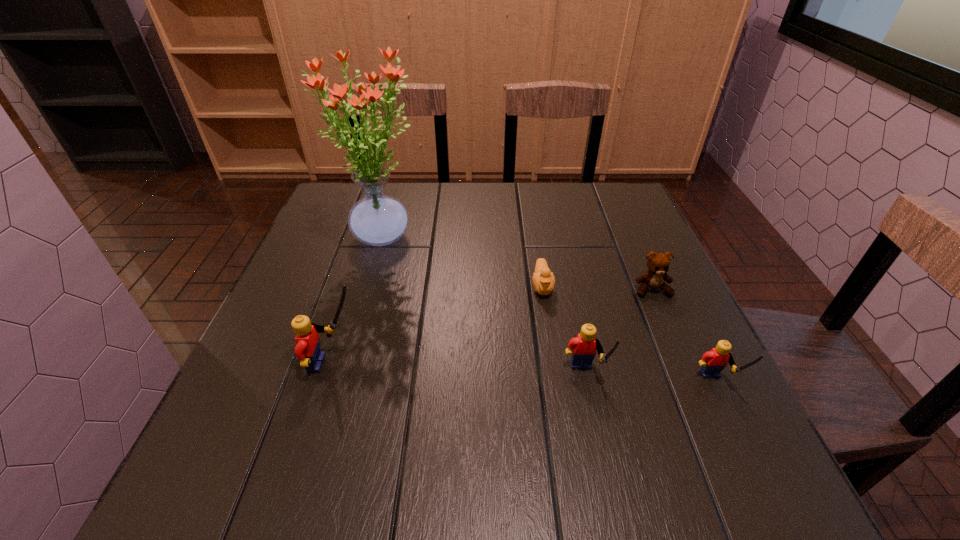
To make them evenly spaced by inserting another Lego among them, please locate a vacant spot for this new Lego. Please provide its 2D coordinates. Your answer should be formatted as a tuple, i.e. [(x, y)], where the tuple contains the x and y coordinates of a point satisfying the conditions above.

[(457, 370)]